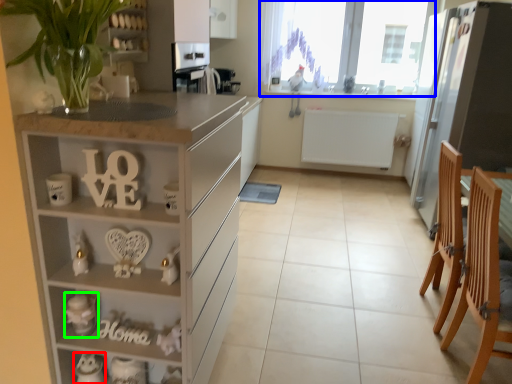
Question: Which object is the closest to the appliance (highlighted by a red box)? Choose among these: window (highlighted by a blue box) or toy (highlighted by a green box).

Choices:
 (A) window
 (B) toy

Answer: (B)